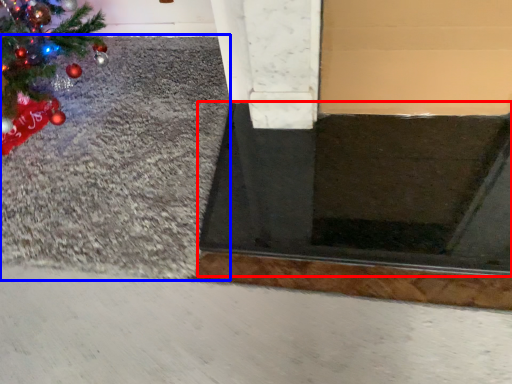
Question: Which of the following is the closest to the observer, doormat (highlighted by a red box) or gravel (highlighted by a blue box)?

Choices:
 (A) doormat
 (B) gravel

Answer: (A)